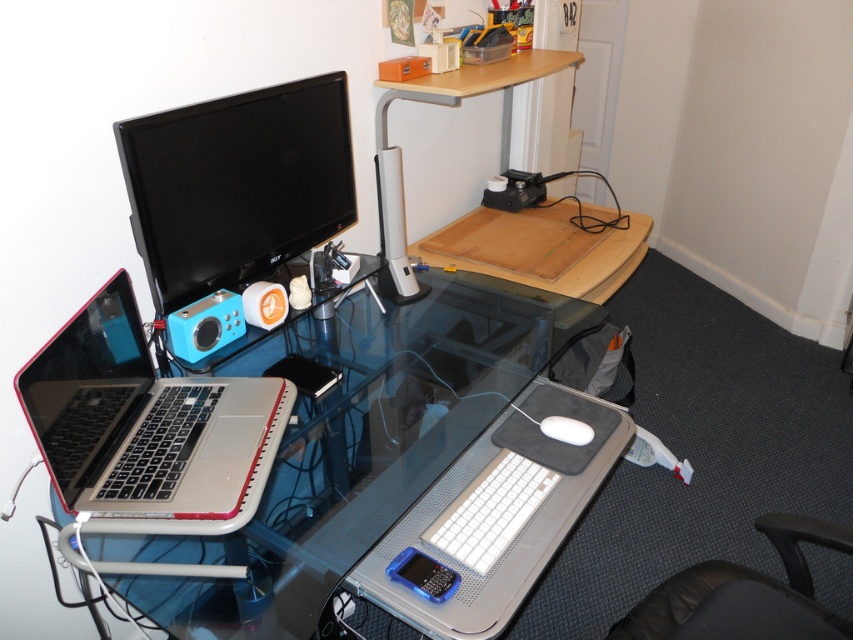
Is the position of silver metallic laptop at left more distant than that of black leather swivel chair at lower right?

That is False.

Does point (274, 403) lie behind point (784, 522)?

Yes.

Identify the location of silver metallic laptop at left. This screenshot has width=853, height=640. (146, 428).

Does white plastic speaker at center come in front of white matte mouse at center?

That is False.

Which is behind, point (376, 182) or point (590, 435)?

The point (376, 182) is behind.

At what (x,y) coordinates should I click in order to perform the action: click on white plastic speaker at center. Please return your answer as a coordinate pair (x, y). This screenshot has height=640, width=853. Looking at the image, I should click on (393, 227).

Is transparent glass table at center taller than black glossy monitor at upper left?

Correct, transparent glass table at center is much taller as black glossy monitor at upper left.

Does point (200, 420) come in front of point (216, 152)?

Yes, it is in front of point (216, 152).

Does point (366, 540) lie in front of point (302, 92)?

Yes, point (366, 540) is closer to viewer.

Image resolution: width=853 pixels, height=640 pixels. In order to click on transparent glass table at center in this screenshot , I will do `click(350, 449)`.